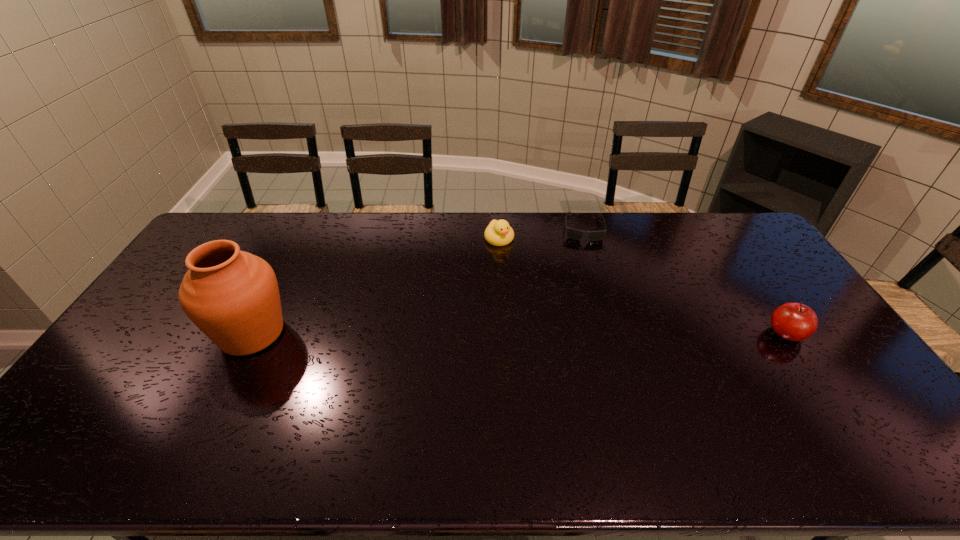
Identify the location of free spot located on the face of the second shortest object. (522, 271).

The width and height of the screenshot is (960, 540). What are the coordinates of `free space located 0.130m on the face of the second shortest object` in the screenshot? It's located at (520, 269).

Where is `blank area located 0.360m on the face of the second shortest object`? The height and width of the screenshot is (540, 960). blank area located 0.360m on the face of the second shortest object is located at coordinates (553, 314).

The height and width of the screenshot is (540, 960). I want to click on vacant space positioned on the front-facing side of the shortest object, so click(588, 314).

Image resolution: width=960 pixels, height=540 pixels. What are the coordinates of `free space located on the front-facing side of the shortest object` in the screenshot? It's located at click(x=588, y=292).

Image resolution: width=960 pixels, height=540 pixels. In order to click on free space located 0.180m on the front-facing side of the shortest object in this screenshot , I will do `click(586, 273)`.

At what (x,y) coordinates should I click in order to perform the action: click on duckling that is positioned at the far edge. Please return your answer as a coordinate pair (x, y). Image resolution: width=960 pixels, height=540 pixels. Looking at the image, I should click on (499, 233).

Find the location of `sunglasses present at the far edge`. sunglasses present at the far edge is located at coordinates (572, 233).

Identify the location of object that is positioned at the right edge. (792, 321).

The width and height of the screenshot is (960, 540). I want to click on vacant area at the far edge, so click(416, 237).